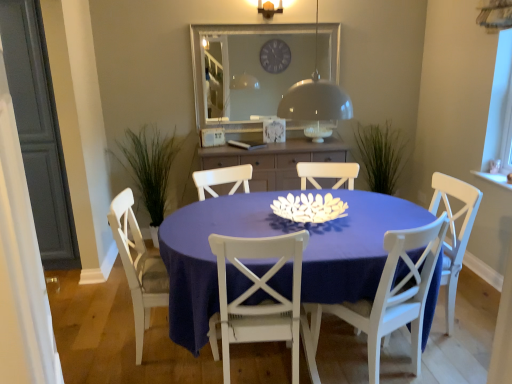
Question: Does matte wood cabinet at center appear on the right side of white wood chair at center, the 2th chair when ordered from right to left?

Choices:
 (A) no
 (B) yes

Answer: (A)

Question: From a real-world perspective, is matte wood cabinet at center below white wood chair at center, placed as the 3th chair when sorted from left to right?

Choices:
 (A) yes
 (B) no

Answer: (B)

Question: Is matte wood cabinet at center facing towards white wood chair at center, placed as the 3th chair when sorted from left to right?

Choices:
 (A) no
 (B) yes

Answer: (B)

Question: From the image's perspective, is matte wood cabinet at center above white wood chair at center, the 2th chair when ordered from right to left?

Choices:
 (A) no
 (B) yes

Answer: (B)

Question: Considering the relative sizes of matte wood cabinet at center and white wood chair at center, the 2th chair when ordered from right to left, in the image provided, is matte wood cabinet at center shorter than white wood chair at center, the 2th chair when ordered from right to left,?

Choices:
 (A) no
 (B) yes

Answer: (B)

Question: Is matte wood cabinet at center next to white wood chair at center, placed as the 3th chair when sorted from left to right, and touching it?

Choices:
 (A) yes
 (B) no

Answer: (B)

Question: From a real-world perspective, is white matte flower at center on matte blue table at center?

Choices:
 (A) no
 (B) yes

Answer: (B)

Question: From the image's perspective, would you say white matte flower at center is shown under matte blue table at center?

Choices:
 (A) yes
 (B) no

Answer: (B)

Question: Can you confirm if white matte flower at center is shorter than matte blue table at center?

Choices:
 (A) no
 (B) yes

Answer: (B)

Question: Is white matte flower at center in front of matte blue table at center?

Choices:
 (A) yes
 (B) no

Answer: (B)

Question: Considering the relative sizes of white matte flower at center and matte blue table at center in the image provided, is white matte flower at center thinner than matte blue table at center?

Choices:
 (A) yes
 (B) no

Answer: (A)

Question: Is white matte flower at center not inside matte blue table at center?

Choices:
 (A) no
 (B) yes

Answer: (A)

Question: Is clear glass mirror at upper center a part of matte blue table at center?

Choices:
 (A) yes
 (B) no

Answer: (B)